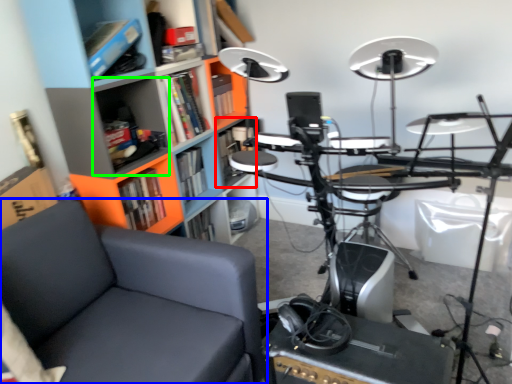
Question: Which object is positioned farthest from shelf (highlighted by a red box)? Select from chair (highlighted by a blue box) and shelf (highlighted by a green box).

Choices:
 (A) chair
 (B) shelf

Answer: (A)